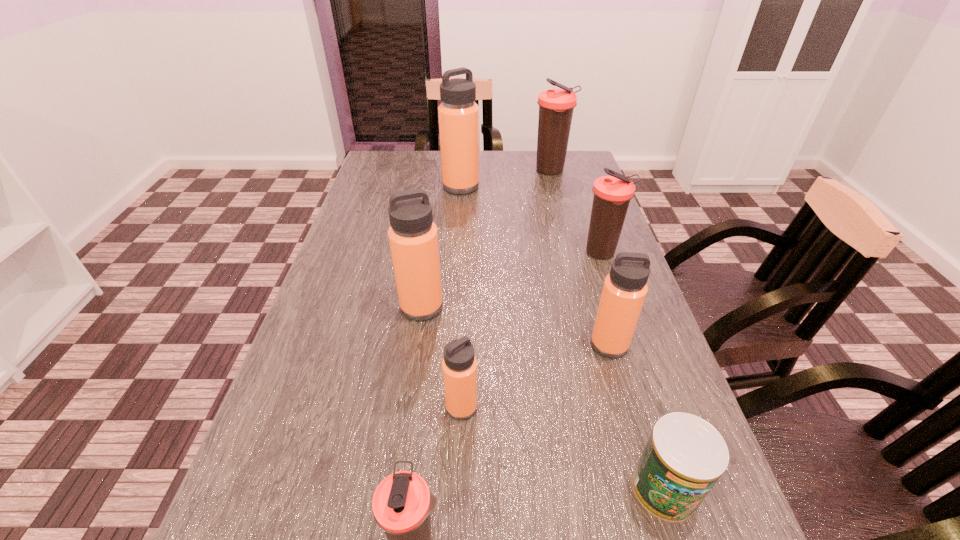
This screenshot has height=540, width=960. In order to click on the biggest orange thermos bottle in this screenshot , I will do `click(458, 114)`.

Identify the location of the farthest orange thermos bottle. This screenshot has height=540, width=960. (458, 114).

At what (x,y) coordinates should I click in order to perform the action: click on the biggest brown thermos bottle. Please return your answer as a coordinate pair (x, y). This screenshot has height=540, width=960. Looking at the image, I should click on (556, 106).

Identify the location of the third nearest orange thermos bottle. (413, 237).

Locate an element on the screen. Image resolution: width=960 pixels, height=540 pixels. the third smallest orange thermos bottle is located at coordinates (413, 237).

Identify the location of the second biggest brown thermos bottle. This screenshot has width=960, height=540. (612, 194).

Find the location of a particular element. the second nearest brown thermos bottle is located at coordinates (612, 194).

This screenshot has height=540, width=960. I want to click on the rightmost orange thermos bottle, so click(624, 291).

Identify the location of the fourth nearest object. (624, 291).

Find the location of a particular element. This screenshot has height=540, width=960. the second nearest thermos bottle is located at coordinates (459, 366).